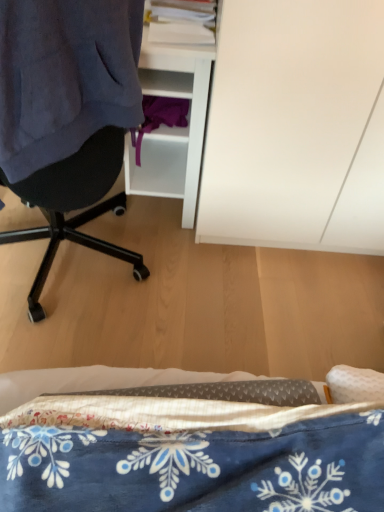
Question: Is blue printed fabric at lower center located within dark blue fabric at left?

Choices:
 (A) no
 (B) yes

Answer: (A)

Question: Is dark blue fabric at left in front of blue printed fabric at lower center?

Choices:
 (A) yes
 (B) no

Answer: (B)

Question: From the image's perspective, is dark blue fabric at left above blue printed fabric at lower center?

Choices:
 (A) no
 (B) yes

Answer: (B)

Question: Considering the relative sizes of dark blue fabric at left and blue printed fabric at lower center in the image provided, is dark blue fabric at left taller than blue printed fabric at lower center?

Choices:
 (A) yes
 (B) no

Answer: (A)

Question: Would you say dark blue fabric at left is a long distance from blue printed fabric at lower center?

Choices:
 (A) yes
 (B) no

Answer: (B)

Question: Is dark blue fabric at left bigger than blue printed fabric at lower center?

Choices:
 (A) no
 (B) yes

Answer: (B)

Question: Can you confirm if white matte cabinet at upper right is taller than blue printed fabric at lower center?

Choices:
 (A) yes
 (B) no

Answer: (A)

Question: Is white matte cabinet at upper right positioned far away from blue printed fabric at lower center?

Choices:
 (A) no
 (B) yes

Answer: (A)

Question: Does white matte cabinet at upper right have a lesser width compared to blue printed fabric at lower center?

Choices:
 (A) no
 (B) yes

Answer: (A)

Question: From the image's perspective, is white matte cabinet at upper right on blue printed fabric at lower center?

Choices:
 (A) no
 (B) yes

Answer: (B)

Question: Is white matte cabinet at upper right oriented away from blue printed fabric at lower center?

Choices:
 (A) yes
 (B) no

Answer: (B)

Question: Considering the relative positions of white matte cabinet at upper right and blue printed fabric at lower center in the image provided, is white matte cabinet at upper right to the right of blue printed fabric at lower center from the viewer's perspective?

Choices:
 (A) yes
 (B) no

Answer: (A)

Question: From the image's perspective, is white matte cabinet at upper right above dark blue fabric at left?

Choices:
 (A) yes
 (B) no

Answer: (A)